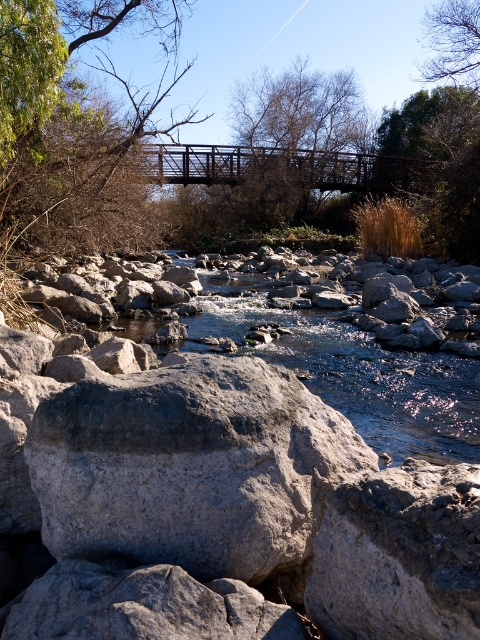
Which is below, gray rock at center or brown leafy tree at upper center?

gray rock at center is lower down.

Is point (22, 600) closer to camera compared to point (320, 84)?

Yes, it is in front of point (320, 84).

Identify the location of gray rock at center. The image size is (480, 640). (214, 502).

You are a GUI agent. You are given a task and a screenshot of the screen. Output one action in this format:
    pyautogui.click(x=<x>, y=<y>)
    Task: Click on the brown leafy tree at upper center
    
    Given the screenshot: What is the action you would take?
    pyautogui.click(x=300, y=109)

Is brown leafy tree at upper center positioned before green leafy tree at upper right?

That is False.

Is point (308, 93) farther from camera compared to point (430, 32)?

Yes, point (308, 93) is behind point (430, 32).

What are the coordinates of `brown leafy tree at upper center` in the screenshot? It's located at (300, 109).

Is gray rock at center shorter than green leafy tree at upper right?

Yes, gray rock at center is shorter than green leafy tree at upper right.

Is gray rock at center to the right of green leafy tree at upper right from the viewer's perspective?

No, gray rock at center is not to the right of green leafy tree at upper right.

Who is more distant from viewer, (301, 524) or (458, 65)?

→ Point (458, 65)

The width and height of the screenshot is (480, 640). I want to click on gray rock at center, so click(x=214, y=502).